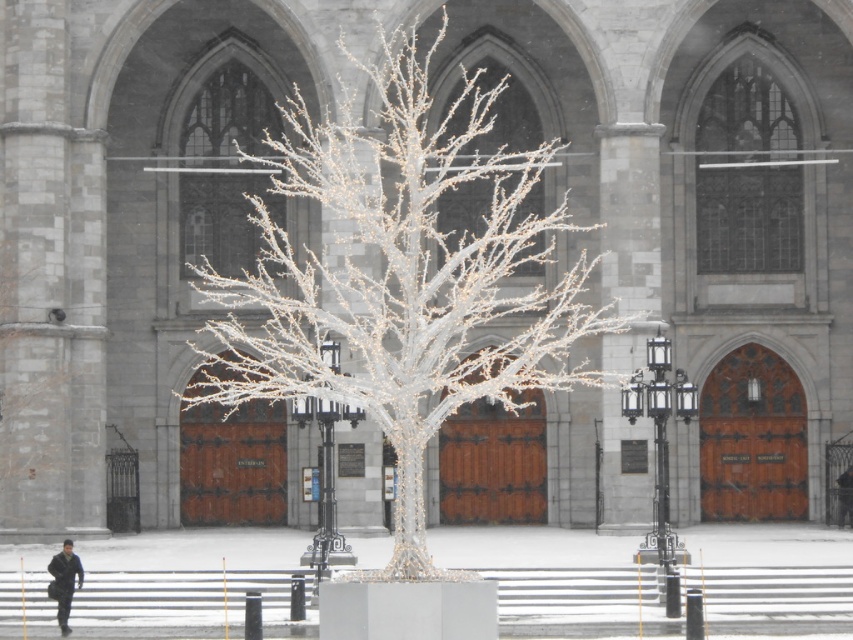
You are an event planner setting up decorations for a winter festival. You need to place a large banner that requires a support structure. Based on the scene, which object between the icy white branches at center and the dark blue uniform at lower left would be more suitable for attaching the banner?

The icy white branches at center is bigger than the dark blue uniform at lower left, so the icy white branches at center would be more suitable for attaching the large banner as it provides a larger and sturdier support structure.

You are a visitor at this winter scene and want to take a photo of the dark blue uniform at lower left without the icy white branches at center appearing in the frame. Is it possible to do so by adjusting your camera angle?

The icy white branches at center is located above dark blue uniform at lower left, so by angling the camera downward to focus solely on the dark blue uniform at lower left, you can exclude the icy white branches at center from the frame.

You are a delivery person standing at the dark blue uniform at lower left, and you need to deliver a package to the base of the icy white branches at center. The delivery robot you are using has a maximum range of 15 meters. Can the robot complete the delivery without needing a recharge?

The distance between the icy white branches at center and the dark blue uniform at lower left is 13.45 meters. Since the robot can travel up to 15 meters, it can complete the delivery without needing a recharge.